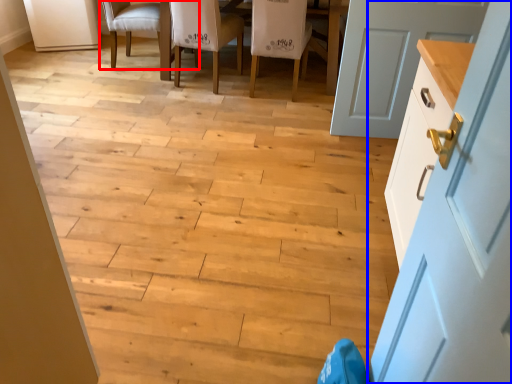
Question: Which object appears closest to the camera in this image, chair (highlighted by a red box) or door (highlighted by a blue box)?

Choices:
 (A) chair
 (B) door

Answer: (B)